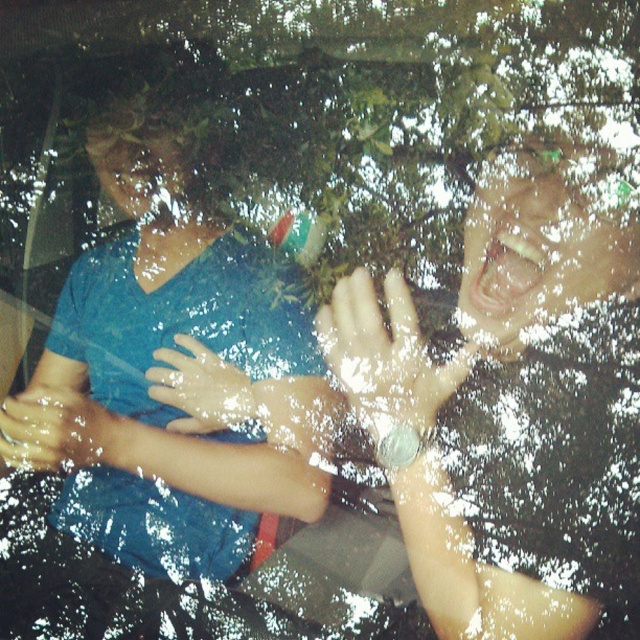
Question: Among these objects, which one is farthest from the camera?

Choices:
 (A) slightly translucent skin at center
 (B) transparent wet hand at center
 (C) blue matte shirt at upper left
 (D) slick rubber hand at lower left

Answer: (A)

Question: Observing the image, what is the correct spatial positioning of transparent wet hand at center in reference to slightly translucent skin at center?

Choices:
 (A) left
 (B) right

Answer: (B)

Question: Which point is farther from the camera taking this photo?

Choices:
 (A) (225, 502)
 (B) (204, 420)
 (C) (364, 275)

Answer: (B)

Question: Is transparent wet hand at center positioned before slick rubber hand at lower left?

Choices:
 (A) yes
 (B) no

Answer: (A)

Question: Can you confirm if blue matte shirt at upper left is smaller than slightly translucent skin at center?

Choices:
 (A) yes
 (B) no

Answer: (B)

Question: Which object appears farthest from the camera in this image?

Choices:
 (A) blue matte shirt at upper left
 (B) slick rubber hand at lower left

Answer: (B)